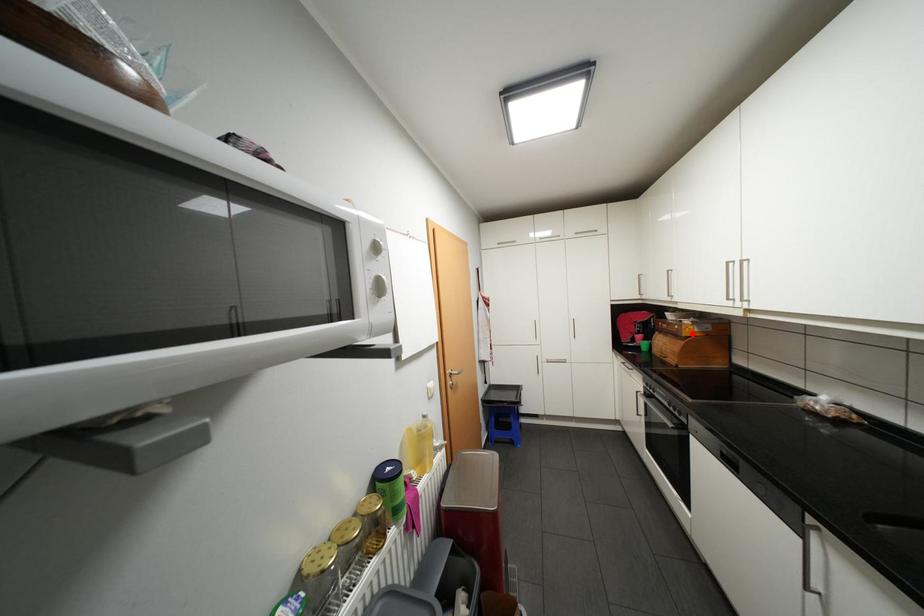
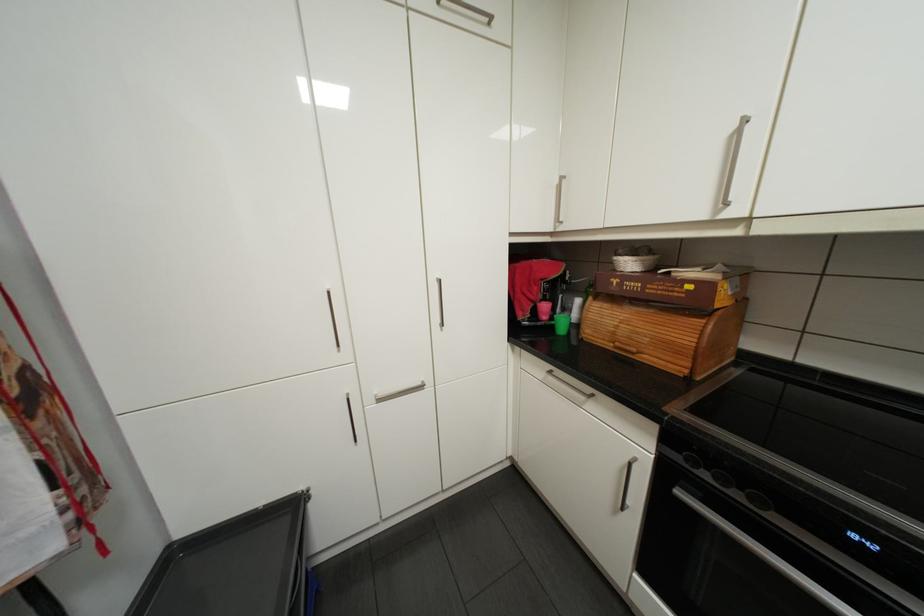
Locate, in the second image, the point that corresponds to the highlighted location in the first image.

(725, 305)